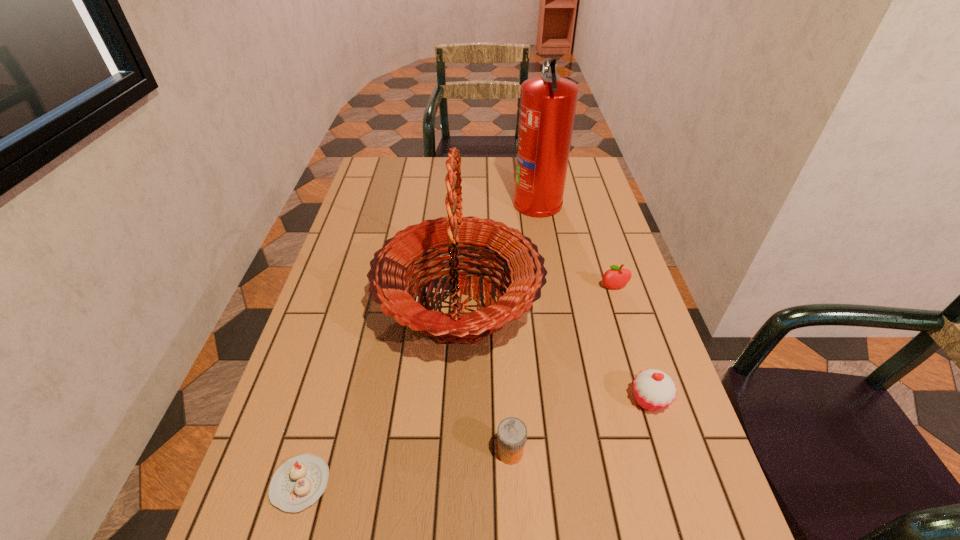
Locate an element on the screen. The image size is (960, 540). the farthest object is located at coordinates (548, 103).

This screenshot has height=540, width=960. What are the coordinates of `the fifth shortest object` in the screenshot? It's located at (523, 266).

Identify the location of the farther cupcake. This screenshot has height=540, width=960. (654, 390).

Locate an element on the screen. Image resolution: width=960 pixels, height=540 pixels. the third nearest object is located at coordinates (654, 390).

I want to click on apple, so click(x=617, y=277).

You are a GUI agent. You are given a task and a screenshot of the screen. Output one action in this format:
    pyautogui.click(x=<x>, y=<y>)
    Task: Click on the medicine
    
    Given the screenshot: What is the action you would take?
    pyautogui.click(x=511, y=432)

I want to click on the left cupcake, so click(x=297, y=484).

You are a GUI agent. You are given a task and a screenshot of the screen. Output one action in this format:
    pyautogui.click(x=<x>, y=<y>)
    Task: Click on the leftmost object
    
    Given the screenshot: What is the action you would take?
    pyautogui.click(x=297, y=484)

Find the location of `blank space located on the instruction side of the farthest object`. blank space located on the instruction side of the farthest object is located at coordinates (444, 201).

Where is `blank area located on the instruction side of the farthest object`? This screenshot has width=960, height=540. blank area located on the instruction side of the farthest object is located at coordinates (441, 201).